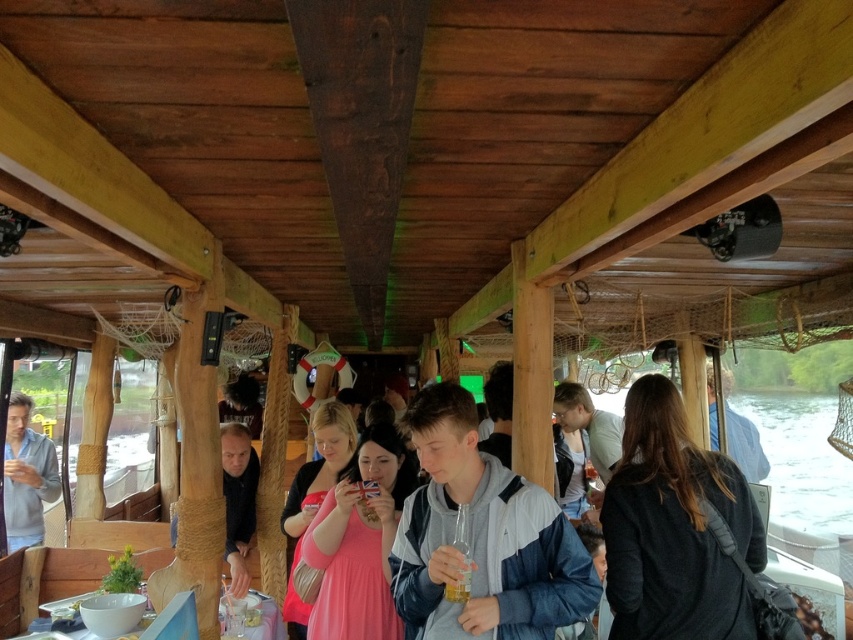
You are a photographer inside the wooden boat and want to capture both the blue fabric jacket at center and the dark blue shirt at center in a single frame. Since you can only focus on one subject at a time, which one would you choose to ensure it appears larger in the photo?

The blue fabric jacket at center has a smaller size compared to dark blue shirt at center, so you should focus on the dark blue shirt at center to make it appear larger in the photo.

You are organizing a space for a small event on the boat and need to ensure there is enough room between the blue fabric jacket at center and the dark blue shirt at center. If the minimum required space between them is 0.5 meters, can you confirm if the current distance meets this requirement?

The blue fabric jacket at center is wider than the dark blue shirt at center, but the objects description does not provide specific distance information between them. Therefore, it is impossible to determine if the current distance meets the 0.5 meters requirement based on the given information.

You are standing at the entrance of the wooden boat and notice a pink fabric dress at center. Where is the pink fabric dress positioned relative to the entrance?

The pink fabric dress at center is located at point [358,541], which means it is positioned to the right and slightly forward from the entrance.